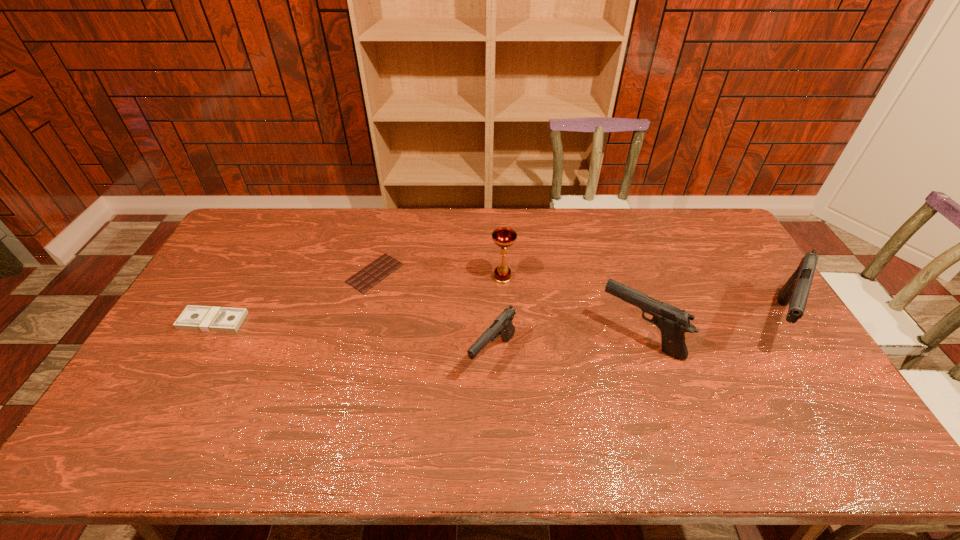
I want to click on object located in the right edge section of the desktop, so click(795, 292).

Where is `blank area at the far edge`? The width and height of the screenshot is (960, 540). blank area at the far edge is located at coordinates (322, 210).

At what (x,y) coordinates should I click in order to perform the action: click on vacant space at the near edge of the desktop. Please return your answer as a coordinate pair (x, y). Looking at the image, I should click on (655, 396).

Find the location of a particular element. vacant space at the left edge of the desktop is located at coordinates (187, 342).

Identify the location of vacant space at the right edge of the desktop. This screenshot has width=960, height=540. (726, 255).

You are a GUI agent. You are given a task and a screenshot of the screen. Output one action in this format:
    pyautogui.click(x=<x>, y=<y>)
    Task: Click on the vacant space at the far left corner of the desktop
    
    Given the screenshot: What is the action you would take?
    pyautogui.click(x=240, y=239)

The width and height of the screenshot is (960, 540). Find the location of `free space at the far right corner of the desktop`. free space at the far right corner of the desktop is located at coordinates (713, 218).

In order to click on vacant space that is in between the second tallest gun and the tallest gun in this screenshot , I will do `click(708, 329)`.

Where is `empty space that is in between the second gun from left to right and the shortest gun`? This screenshot has width=960, height=540. empty space that is in between the second gun from left to right and the shortest gun is located at coordinates (566, 346).

Identify the location of free space that is in between the dollar and the chocolate bar. Image resolution: width=960 pixels, height=540 pixels. (294, 297).